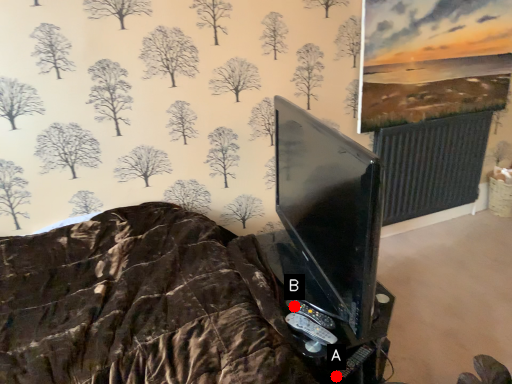
Question: Two points are circled on the image, labeled by A and B beside each circle. Which point is farther to the camera?

Choices:
 (A) A is further
 (B) B is further

Answer: (B)